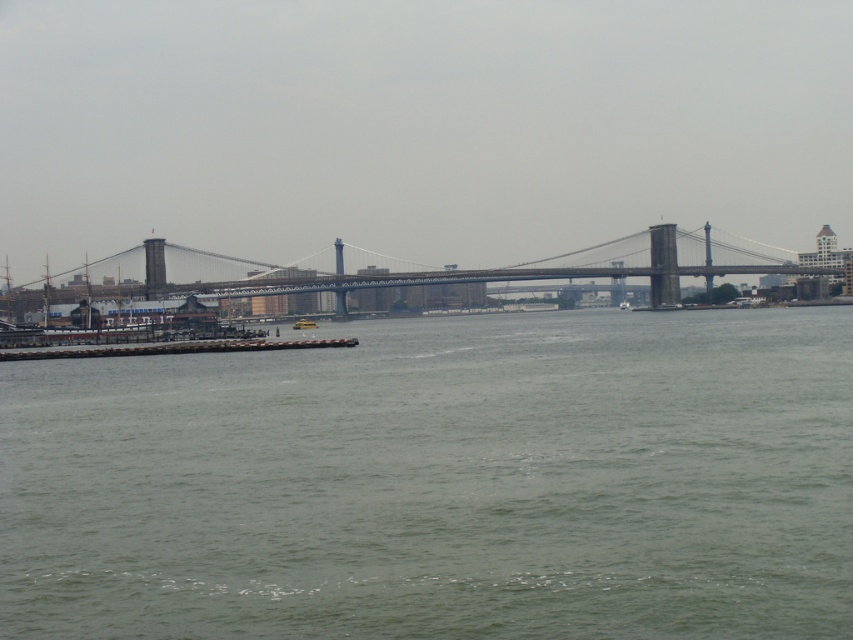
Consider the image. You are a delivery drone that needs to fly from the starting point to the destination point. You see the metallic gray bridge at center and the yellow plastic boat at center in your path. Which object do you need to fly over to avoid collision?

You need to fly over the metallic gray bridge at center because it is located above the yellow plastic boat at center in the scene.

You are standing on the suspension bridge and looking down at the water. You see the green water at lower center and the yellow plastic boat at center. Which object is positioned to the right of the other?

The green water at lower center is to the right of the yellow plastic boat at center.